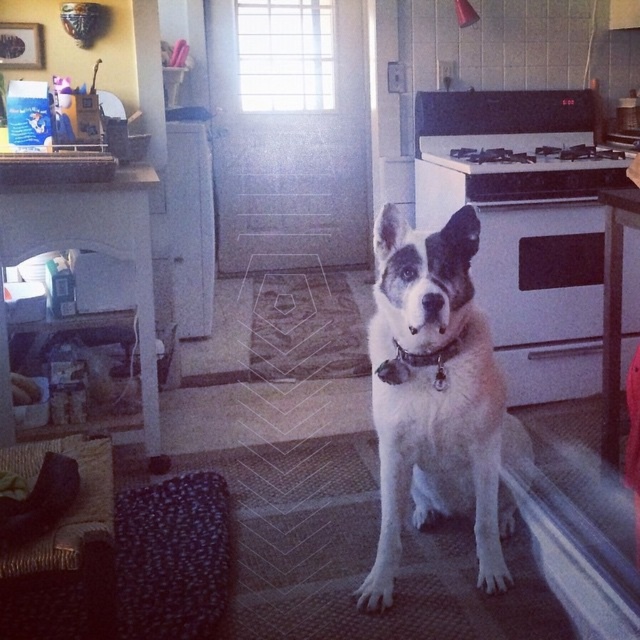
Is white fur dog at center to the right of black leather collar at center from the viewer's perspective?

Indeed, white fur dog at center is positioned on the right side of black leather collar at center.

Can you confirm if white fur dog at center is positioned below black leather collar at center?

Yes, white fur dog at center is below black leather collar at center.

Is point (490, 362) farther from viewer compared to point (465, 332)?

That is True.

Locate an element on the screen. The image size is (640, 640). white fur dog at center is located at coordinates tap(433, 396).

From the picture: Who is lower down, white glossy oven at center right or black leather collar at center?

black leather collar at center is lower down.

The height and width of the screenshot is (640, 640). Identify the location of white glossy oven at center right. pyautogui.click(x=544, y=296).

Locate an element on the screen. white glossy oven at center right is located at coordinates (544, 296).

Consider the image. Is the position of transparent glass screen door at center less distant than that of matte black exhaust hood at upper center?

No, it is not.

Who is higher up, transparent glass screen door at center or matte black exhaust hood at upper center?

matte black exhaust hood at upper center

The height and width of the screenshot is (640, 640). I want to click on transparent glass screen door at center, so click(289, 140).